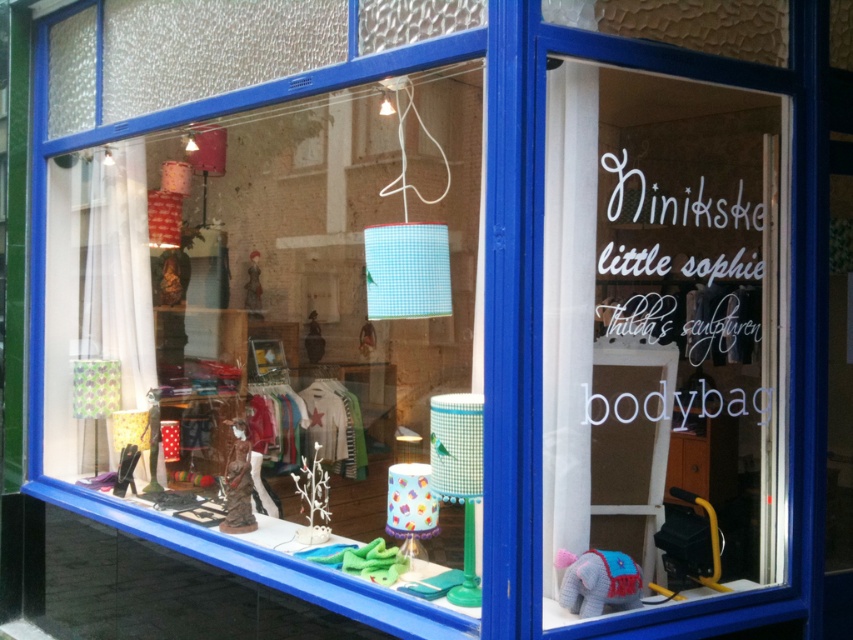
Question: Is knitted plush elephant at lower right below matte brown figurine at center?

Choices:
 (A) yes
 (B) no

Answer: (A)

Question: Which object is farther from the camera taking this photo?

Choices:
 (A) matte brown figurine at center
 (B) blue checkered fabric lampshade at center

Answer: (B)

Question: Can you confirm if matte fabric lampshade at center is positioned to the right of blue checkered fabric lampshade at center?

Choices:
 (A) no
 (B) yes

Answer: (A)

Question: Based on their relative distances, which object is farther from the blue checkered fabric lampshade at center?

Choices:
 (A) matte fabric lampshade at center
 (B) matte brown figurine at center

Answer: (A)

Question: Can you confirm if blue checkered fabric lampshade at center is thinner than knitted plush elephant at lower right?

Choices:
 (A) yes
 (B) no

Answer: (B)

Question: Which point is closer to the camera taking this photo?

Choices:
 (A) (165, 436)
 (B) (612, 573)
 (C) (254, 269)
 (D) (370, 272)

Answer: (B)